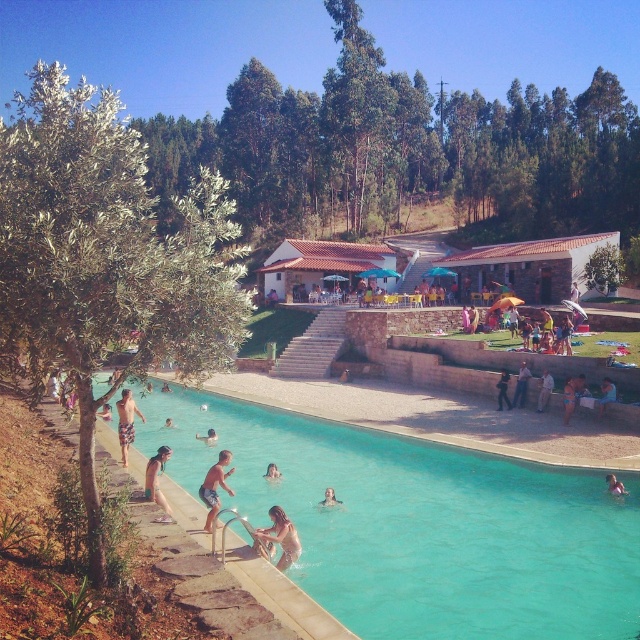
You are a lifeguard standing at the center of the pool deck. You notice a swimmer wearing a green fabric bikini at lower left. Where would you look to find this swimmer relative to your position?

The green fabric bikini at lower left is located at coordinates approximately 0.755 on the x axis and 0.247 on the y axis relative to the center of the pool deck. Since the coordinates are given from the center, the swimmer is positioned to the right and slightly below the lifeguard.

You are a photographer at the poolside and want to capture both the green fabric bikini at lower left and plaid shorts at lower left in the same frame. Which object is wider so that you can adjust your camera angle accordingly?

The green fabric bikini at lower left is wider than the plaid shorts at lower left, so you should adjust your camera angle to ensure both fit in the frame by focusing on the wider object first.